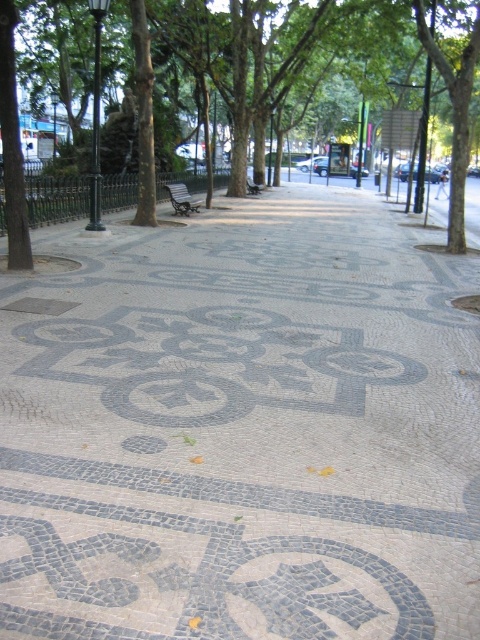
You are standing at the point closer to the camera in the image. Which point are you at, point (277, 365) or point (468, 132)?

You are at point (277, 365) because it is closer to the camera than point (468, 132).

You are standing on the pedestrian walkway and want to reach the point marked at coordinates (415, 368). Considering the walkway is 20 feet wide, can you safely walk straight to that point without stepping off the walkway?

The point at coordinates (415, 368) is 20.47 feet away from the viewer. Since the walkway is 20 feet wide, walking straight to the point would require stepping beyond the walkway, making it unsafe.